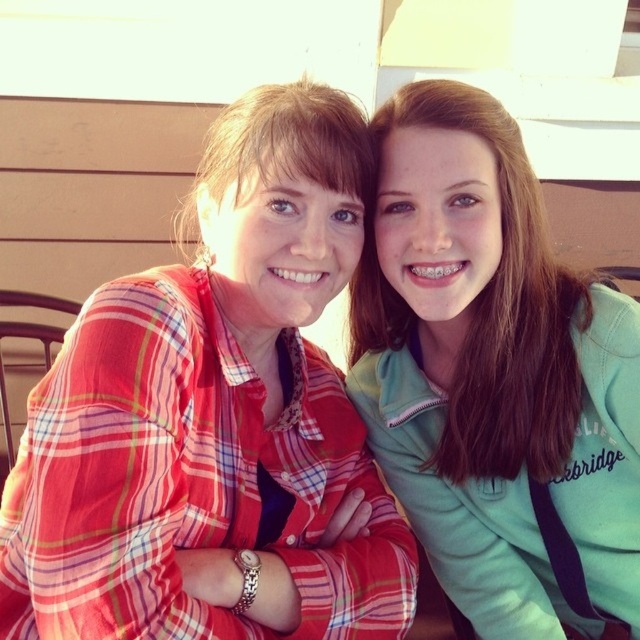
You are a photographer setting up a shot of the two people in the image. The plaid shirt at center and the teal fleece jacket at upper right are both in the frame. To ensure both subjects are fully visible, should you adjust the camera angle to focus more on the background or keep it as is?

The plaid shirt at center is in front of the teal fleece jacket at upper right, so adjusting the camera angle to focus more on the background might not be necessary. Keeping the current angle ensures both subjects are visible since the plaid shirt is already positioned in front, allowing the teal fleece jacket at upper right to be seen behind it.

You are standing in the park and see two points marked in the image. The first point is labeled as point [234,316] and the second is point [474,484]. Which point is closer to you?

Point [234,316] is in front of point [474,484], so it is closer to you.

You are a photographer planning to capture a portrait of the two people in the scene. You need to ensure that both the plaid shirt at center and the teal fleece jacket at upper right are fully visible in the frame. Based on their positions and sizes, do you think you can fit both subjects comfortably within a standard rectangular camera frame without cropping either of their clothing items?

The plaid shirt at center might be wider than teal fleece jacket at upper right, so it is possible to fit both within the frame as long as the camera is positioned to include the full width of the plaid shirt at center. The teal fleece jacket at upper right, being narrower, should also fit comfortably within the same frame.